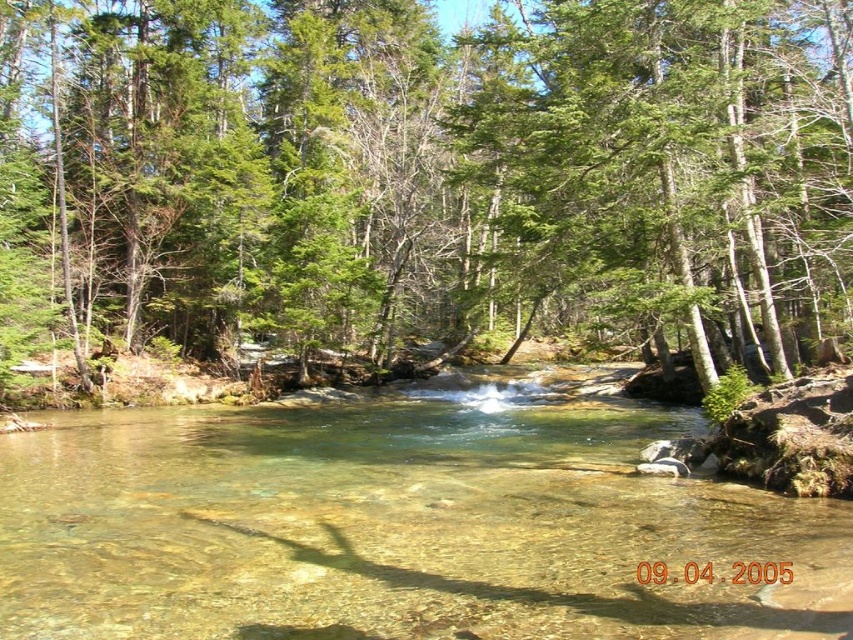
Based on the photo, is green leafy tree at center taller than clear glass river at center?

Yes, green leafy tree at center is taller than clear glass river at center.

Is point (724, 189) behind point (440, 579)?

Yes.

Is point (196, 349) in front of point (769, 529)?

That is False.

What are the coordinates of `green leafy tree at center` in the screenshot? It's located at (425, 177).